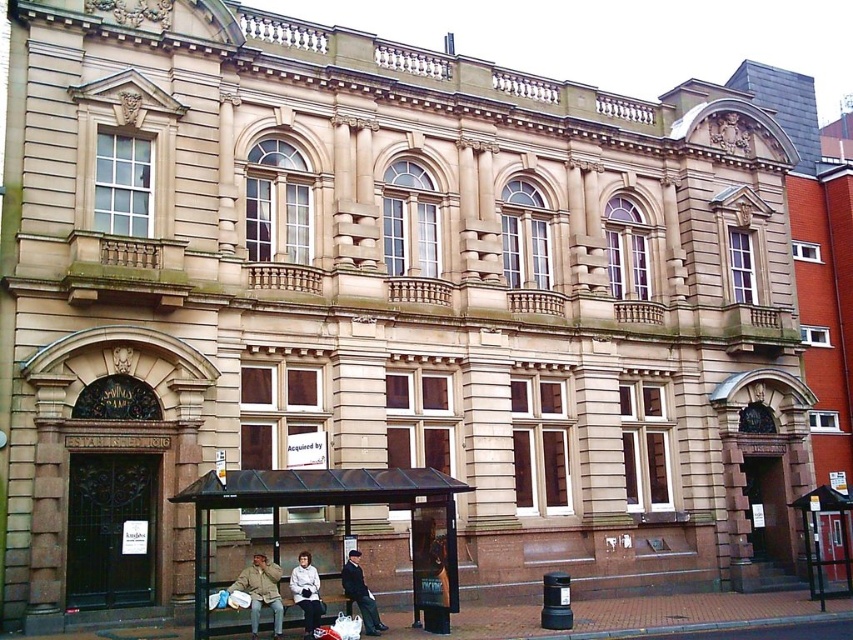
Question: Based on their relative distances, which object is nearer to the black metal bus stop at lower left?

Choices:
 (A) white fabric coat at lower center
 (B) khaki fabric jacket at lower center
 (C) dark blue fabric coat at lower center

Answer: (C)

Question: Among these points, which one is farthest from the camera?

Choices:
 (A) (453, 529)
 (B) (312, 586)

Answer: (A)

Question: Does black metal bus stop at lower left appear on the left side of khaki fabric jacket at lower center?

Choices:
 (A) no
 (B) yes

Answer: (A)

Question: Does khaki fabric jacket at lower center have a smaller size compared to dark blue fabric coat at lower center?

Choices:
 (A) no
 (B) yes

Answer: (A)

Question: Which is farther from the white fabric coat at lower center?

Choices:
 (A) dark blue fabric coat at lower center
 (B) black metal bus stop at lower left
 (C) khaki fabric jacket at lower center

Answer: (B)

Question: Is khaki fabric jacket at lower center wider than dark blue fabric coat at lower center?

Choices:
 (A) no
 (B) yes

Answer: (B)